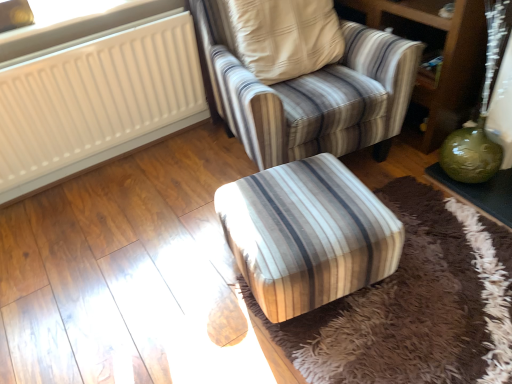
Where is `vacant space situated on the left part of green glossy vase at right`? The height and width of the screenshot is (384, 512). vacant space situated on the left part of green glossy vase at right is located at coordinates (412, 196).